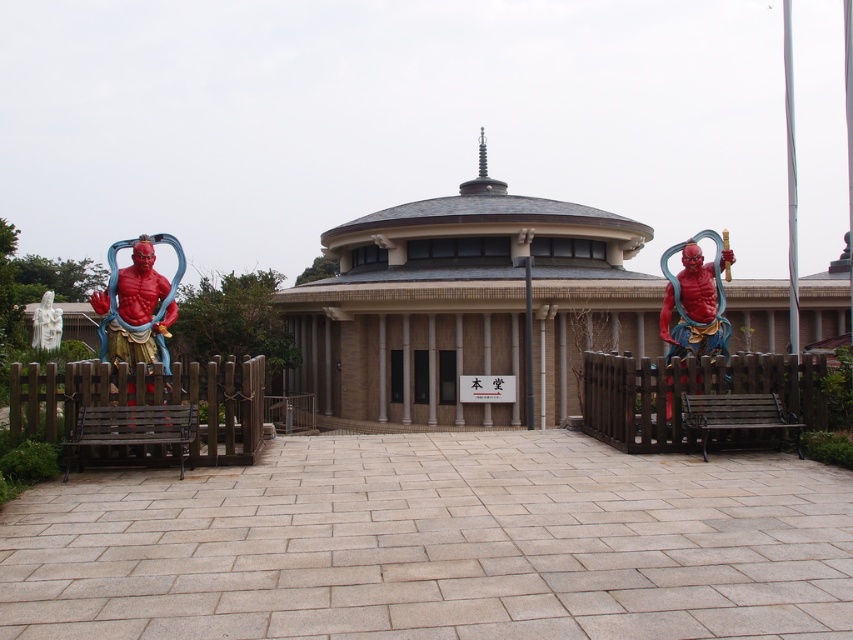
Question: Which object is positioned farthest from the smooth wood pole at center?

Choices:
 (A) matte red statue at right
 (B) shiny red statue at left

Answer: (B)

Question: Among these objects, which one is farthest from the camera?

Choices:
 (A) smooth wood pole at center
 (B) white marble statue at lower left
 (C) shiny red statue at left

Answer: (B)

Question: Does shiny red statue at left have a larger size compared to matte red statue at right?

Choices:
 (A) no
 (B) yes

Answer: (B)

Question: Which point is closer to the camera?

Choices:
 (A) (103, 291)
 (B) (531, 420)
 (C) (51, 314)

Answer: (B)

Question: Does matte red statue at right appear on the right side of white marble statue at lower left?

Choices:
 (A) yes
 (B) no

Answer: (A)

Question: Can you confirm if shiny red statue at left is wider than matte red statue at right?

Choices:
 (A) yes
 (B) no

Answer: (A)